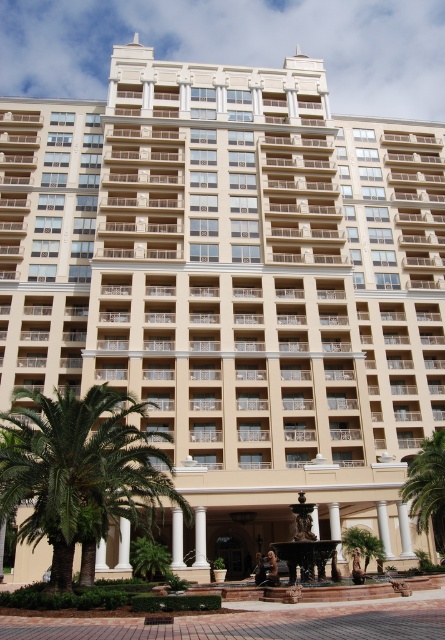
Does green leafy palm tree at lower left appear on the right side of green leafy palm tree at center?

No, green leafy palm tree at lower left is not to the right of green leafy palm tree at center.

Where is `green leafy palm tree at lower left`? Image resolution: width=445 pixels, height=640 pixels. green leafy palm tree at lower left is located at coordinates (80, 472).